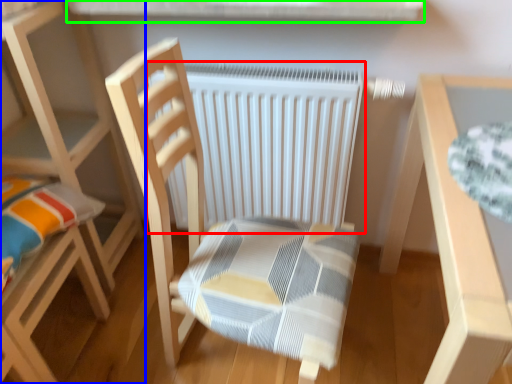
Question: Which is nearer to the radiator (highlighted by a red box)? chair (highlighted by a blue box) or window sill (highlighted by a green box).

Choices:
 (A) chair
 (B) window sill

Answer: (B)